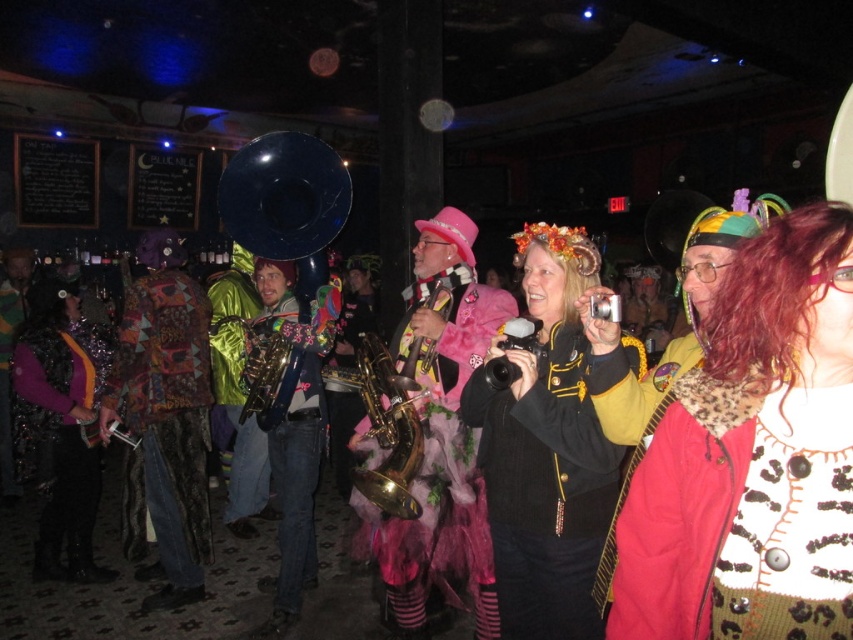
Question: Is multicolored woven fabric at center positioned before gold brass saxophone at center?

Choices:
 (A) yes
 (B) no

Answer: (B)

Question: Is leopard print jacket at center behind shiny metallic vest at center?

Choices:
 (A) no
 (B) yes

Answer: (A)

Question: Which object appears farthest from the camera in this image?

Choices:
 (A) matte black jacket at center
 (B) leopard print jacket at center

Answer: (A)

Question: Among these objects, which one is farthest from the camera?

Choices:
 (A) shiny metallic vest at center
 (B) pink tulle skirt at center
 (C) shiny metallic saxophone at center

Answer: (A)

Question: Among these objects, which one is farthest from the camera?

Choices:
 (A) matte black jacket at center
 (B) shiny metallic saxophone at center
 (C) pink tulle skirt at center

Answer: (B)

Question: Does pink tulle skirt at center have a lesser width compared to shiny metallic saxophone at center?

Choices:
 (A) yes
 (B) no

Answer: (B)